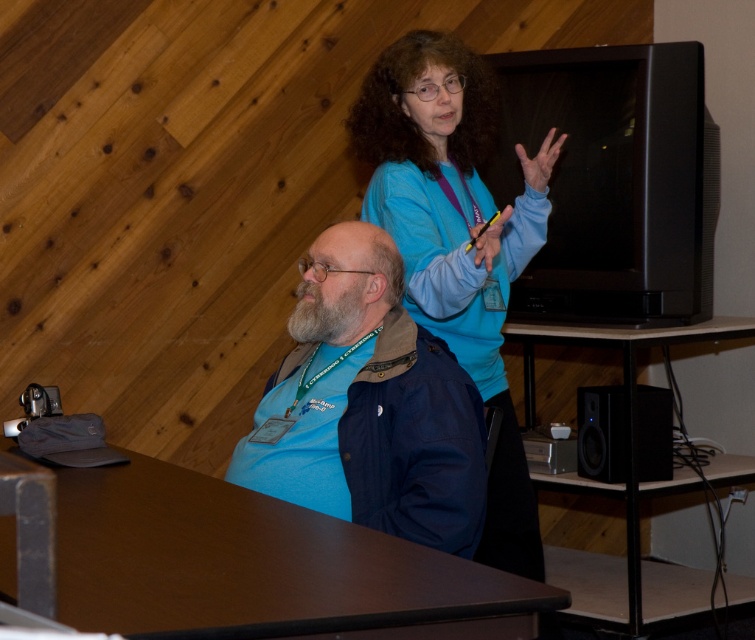
Question: Is blue denim jacket at center to the right of blue fabric shirt at upper center from the viewer's perspective?

Choices:
 (A) yes
 (B) no

Answer: (B)

Question: Which point is closer to the camera?

Choices:
 (A) (476, 256)
 (B) (482, 301)

Answer: (A)

Question: Does brown wood table at lower left have a lesser width compared to blue denim jacket at center?

Choices:
 (A) no
 (B) yes

Answer: (A)

Question: Considering the real-world distances, which object is closest to the blue fabric shirt at upper center?

Choices:
 (A) dry skin hand at upper center
 (B) black plastic speaker at lower right

Answer: (A)

Question: In this image, where is brown wood table at lower left located relative to blue fabric shirt at upper center?

Choices:
 (A) left
 (B) right

Answer: (A)

Question: Among these objects, which one is farthest from the camera?

Choices:
 (A) black plastic speaker at lower right
 (B) brown wood table at lower left

Answer: (A)